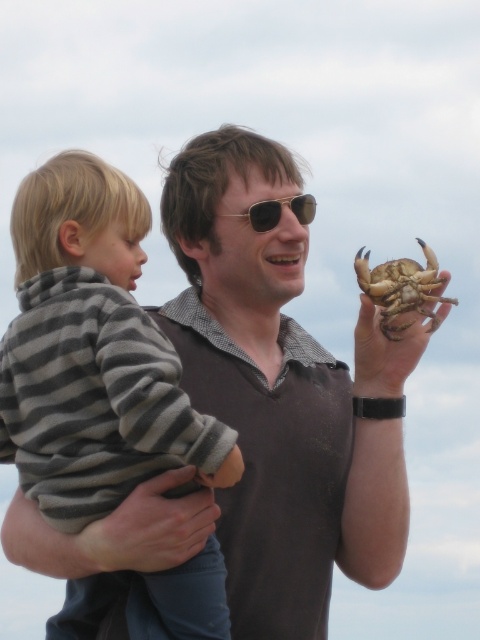
Is point (118, 467) behind point (441, 307)?

No, (118, 467) is in front of (441, 307).

Does striped fleece sweater at left have a lesser width compared to brown textured crab claw at upper right?

In fact, striped fleece sweater at left might be wider than brown textured crab claw at upper right.

Locate an element on the screen. The width and height of the screenshot is (480, 640). striped fleece sweater at left is located at coordinates (93, 340).

The width and height of the screenshot is (480, 640). What are the coordinates of `striped fleece sweater at left` in the screenshot? It's located at (93, 340).

Can you confirm if brown textured crab claw at upper right is bigger than gold metallic sunglasses at center?

Yes, brown textured crab claw at upper right is bigger than gold metallic sunglasses at center.

Is brown textured crab claw at upper right positioned at the back of gold metallic sunglasses at center?

No, brown textured crab claw at upper right is closer to the viewer.

Between point (374, 346) and point (243, 212), which one is positioned in front?

Point (374, 346) is in front.

At what (x,y) coordinates should I click in order to perform the action: click on brown textured crab claw at upper right. Please return your answer as a coordinate pair (x, y). Image resolution: width=480 pixels, height=640 pixels. Looking at the image, I should click on (385, 352).

Can you confirm if striped fleece sweater at left is positioned to the right of brown hard shell crab at upper right?

Incorrect, striped fleece sweater at left is not on the right side of brown hard shell crab at upper right.

Who is positioned more to the left, striped fleece sweater at left or brown hard shell crab at upper right?

striped fleece sweater at left is more to the left.

The image size is (480, 640). Identify the location of striped fleece sweater at left. (93, 340).

Locate an element on the screen. The image size is (480, 640). striped fleece sweater at left is located at coordinates (x=93, y=340).